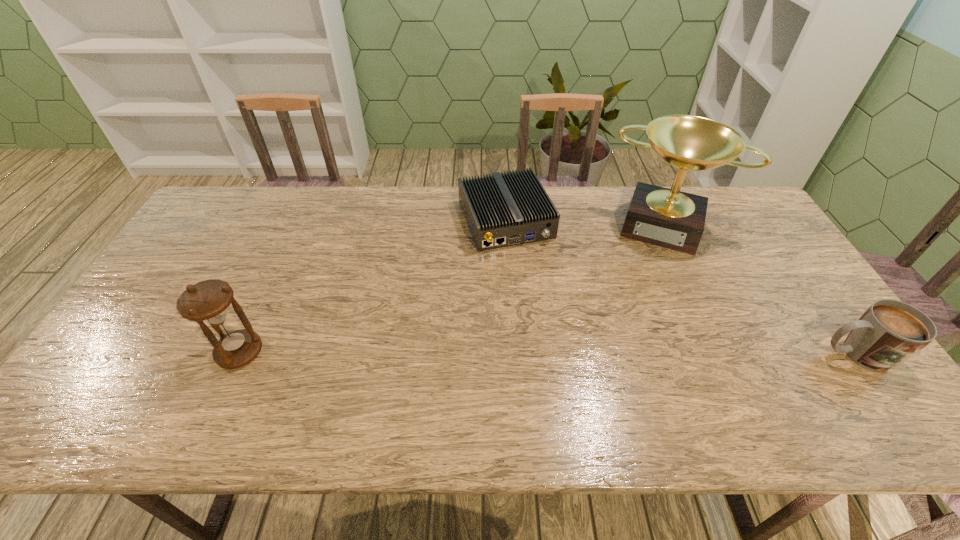
You are a GUI agent. You are given a task and a screenshot of the screen. Output one action in this format:
    pyautogui.click(x=<x>, y=<y>)
    Task: Click on the hourglass present at the near edge
    
    Given the screenshot: What is the action you would take?
    coord(208,301)

Where is `mug that is at the near edge`? mug that is at the near edge is located at coordinates (889, 332).

The width and height of the screenshot is (960, 540). What are the coordinates of `mug at the right edge` in the screenshot? It's located at (889, 332).

The height and width of the screenshot is (540, 960). Identify the location of award located at the right edge. (669, 218).

The width and height of the screenshot is (960, 540). Identify the location of object located at the far right corner. (669, 218).

Identify the location of object that is at the near right corner. The image size is (960, 540). (889, 332).

In the image, there is a desktop. Identify the location of vacant space at the far edge. (391, 219).

In the image, there is a desktop. Identify the location of vacant region at the near edge. (296, 394).

Identify the location of free space at the left edge of the desktop. (141, 360).

Locate an element on the screen. The image size is (960, 540). vacant space at the far left corner is located at coordinates (252, 210).